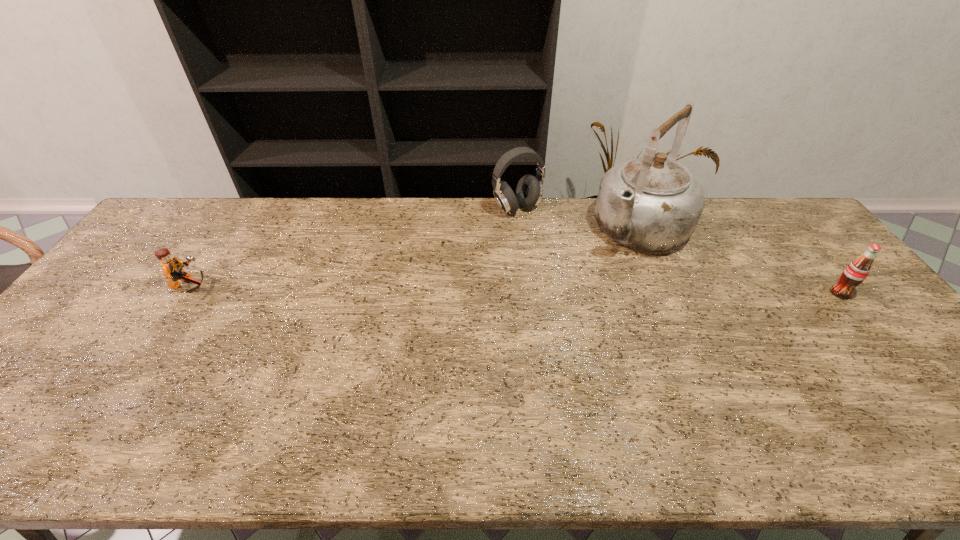
You are a GUI agent. You are given a task and a screenshot of the screen. Output one action in this format:
    pyautogui.click(x=<x>, y=<y>)
    Task: Click on the vacant spot on the desktop that is between the Lego and the soda and is positioned on the ear cups of the third shortest object
    This screenshot has width=960, height=540.
    Given the screenshot: What is the action you would take?
    pyautogui.click(x=575, y=291)

I want to click on vacant space on the desktop that is between the shortest object and the rightmost object and is positioned at the spout of the kettle, so click(x=584, y=291).